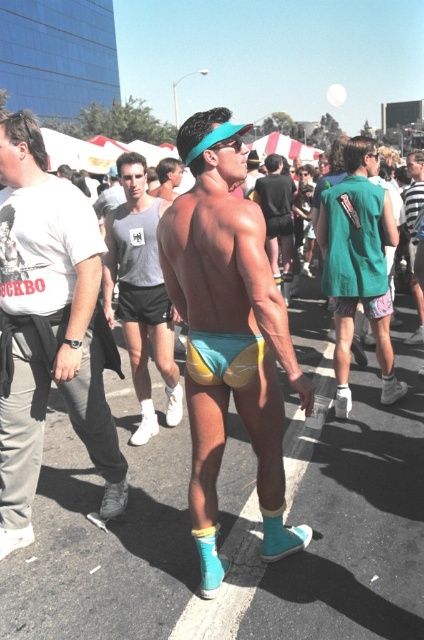
Question: Which object is positioned farthest from the teal fabric shorts at center?

Choices:
 (A) green fabric shorts at center
 (B) matte white t-shirt at left
 (C) yellow fabric shorts at center

Answer: (B)

Question: Is matte yellow and blue shorts at center thinner than matte white t-shirt at left?

Choices:
 (A) no
 (B) yes

Answer: (A)

Question: Considering the relative positions of gray fabric shorts at center and teal and yellow fabric shorts at center in the image provided, where is gray fabric shorts at center located with respect to teal and yellow fabric shorts at center?

Choices:
 (A) below
 (B) above

Answer: (B)

Question: Which object is farther from the camera taking this photo?

Choices:
 (A) gray fabric shorts at center
 (B) yellow fabric shorts at center
 (C) matte yellow and blue shorts at center
 (D) green fabric shorts at center

Answer: (B)

Question: Does matte yellow and blue shorts at center appear over teal fabric shorts at center?

Choices:
 (A) yes
 (B) no

Answer: (B)

Question: Which point is farther to the camera?

Choices:
 (A) (189, 120)
 (B) (131, 300)

Answer: (B)